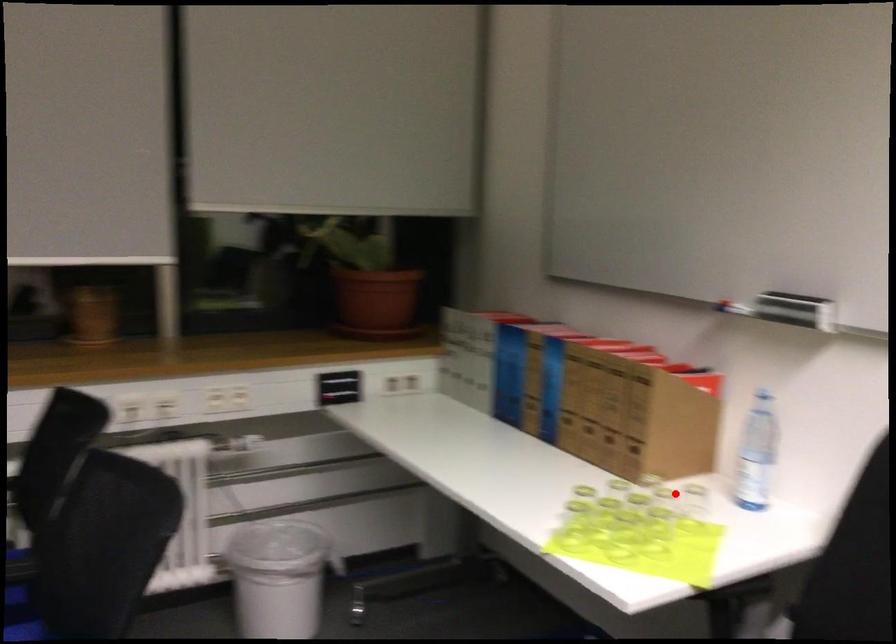
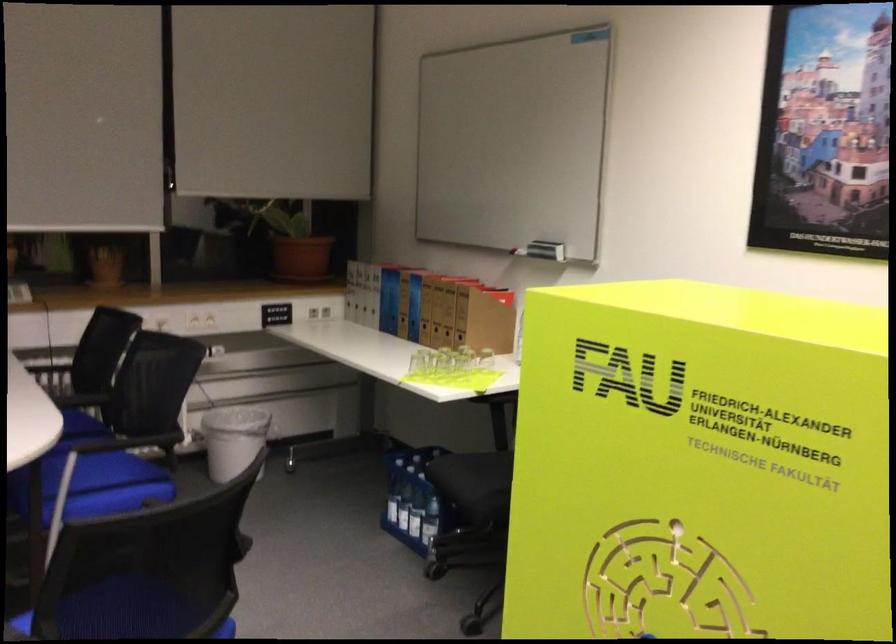
Question: I am providing you with two images of the same scene from different viewpoints. A red point is shown in image1. For the corresponding object point in image2, is it positioned nearer or farther from the camera?

Choices:
 (A) Nearer
 (B) Farther

Answer: (B)